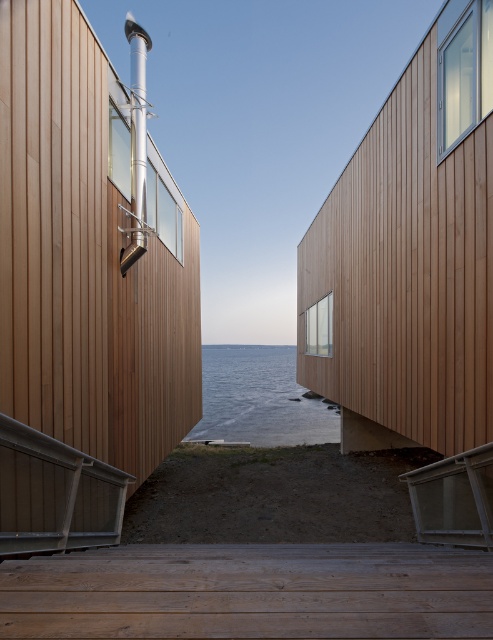
Question: Which of the following is the farthest from the observer?

Choices:
 (A) (173, 548)
 (B) (318, 412)

Answer: (B)

Question: Which point is closer to the camera?

Choices:
 (A) (326, 410)
 (B) (286, 636)

Answer: (B)

Question: Does wooden planks at center have a greater width compared to transparent water at center?

Choices:
 (A) no
 (B) yes

Answer: (A)

Question: Considering the relative positions of metallic gray balustrade at lower left and transparent water at center in the image provided, where is metallic gray balustrade at lower left located with respect to transparent water at center?

Choices:
 (A) above
 (B) below

Answer: (A)

Question: Observing the image, what is the correct spatial positioning of wooden planks at center in reference to metallic gray balustrade at lower left?

Choices:
 (A) right
 (B) left

Answer: (A)

Question: Estimate the real-world distances between objects in this image. Which object is closer to the transparent water at center?

Choices:
 (A) metallic gray balustrade at lower left
 (B) wooden planks at center

Answer: (B)